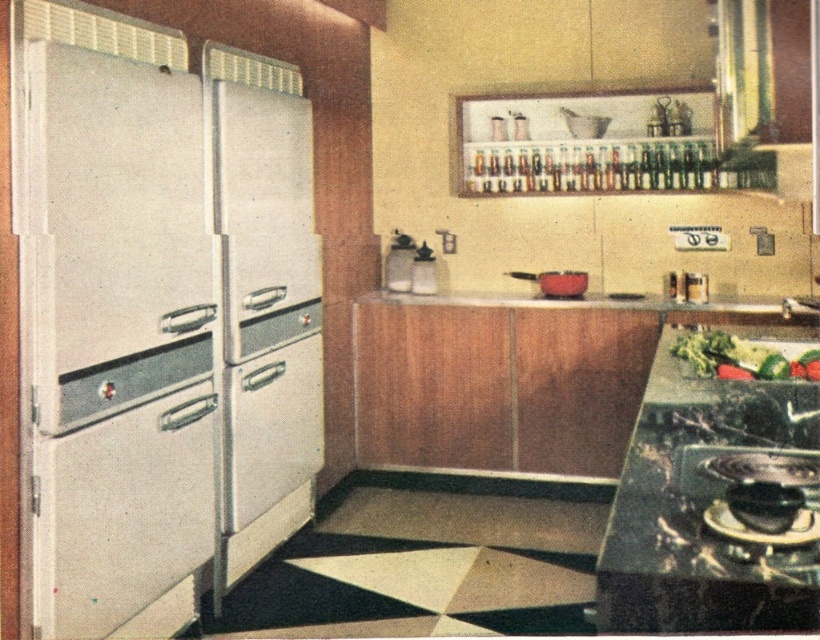
Consider the image. Does metallic gray refrigerator at left come behind red matte pot at center?

No.

Identify the location of metallic gray refrigerator at left. 94,252.

Which is in front, point (178, 129) or point (549, 275)?

Positioned in front is point (178, 129).

Identify the location of metallic gray refrigerator at left. (94, 252).

Who is more forward, (158, 168) or (401, 305)?

Point (158, 168) is in front.

Is point (16, 49) positioned before point (649, 305)?

Yes, it is.

Which is in front, point (42, 586) or point (413, 300)?

Positioned in front is point (42, 586).

Where is `metallic gray refrigerator at left`? Image resolution: width=820 pixels, height=640 pixels. metallic gray refrigerator at left is located at coordinates (94, 252).

Can you confirm if smooth white countertop at center is shorter than red matte pot at center?

Indeed, smooth white countertop at center has a lesser height compared to red matte pot at center.

Can you confirm if smooth white countertop at center is positioned below red matte pot at center?

Correct, smooth white countertop at center is located below red matte pot at center.

This screenshot has width=820, height=640. I want to click on smooth white countertop at center, so click(599, 301).